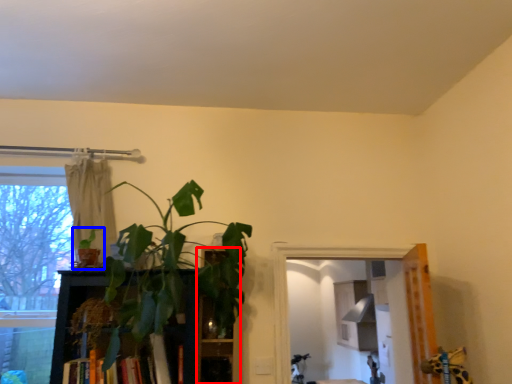
Question: Which object is further to the camera taking this photo, shelf (highlighted by a red box) or houseplant (highlighted by a blue box)?

Choices:
 (A) shelf
 (B) houseplant

Answer: (A)